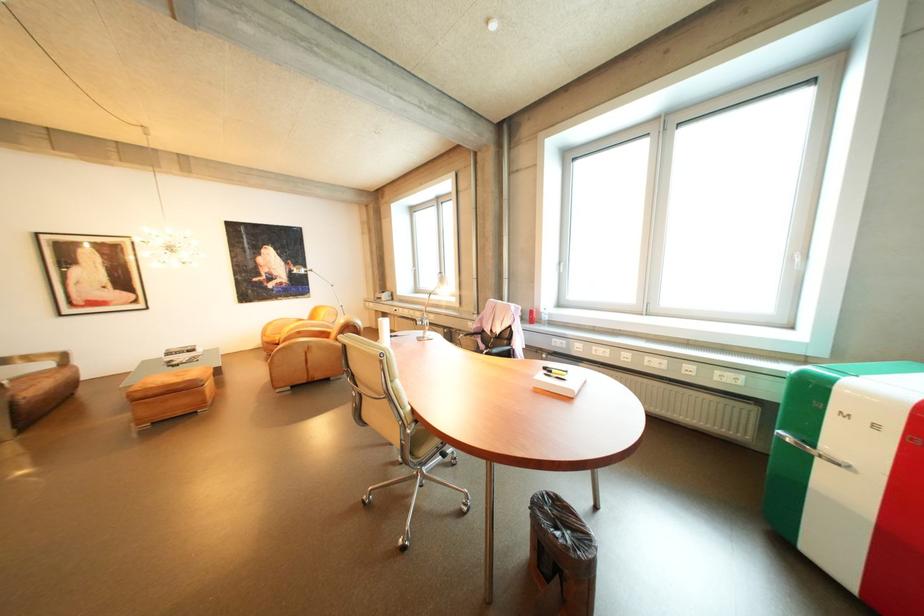
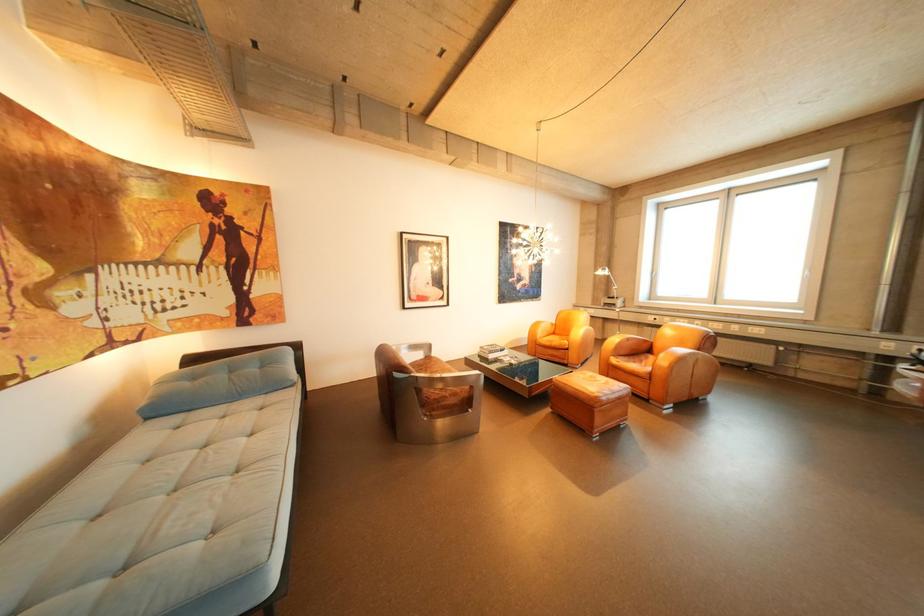
Question: The images are taken continuously from a first-person perspective. In which direction are you moving?

Choices:
 (A) Left
 (B) Right
 (C) Forward
 (D) Backward

Answer: (A)